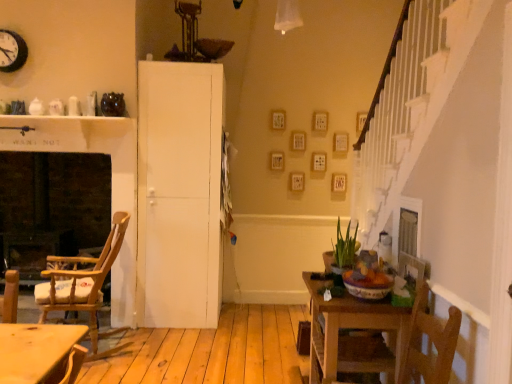
Where is `free point to the right of wooden rocking chair at left`? The height and width of the screenshot is (384, 512). free point to the right of wooden rocking chair at left is located at coordinates (161, 342).